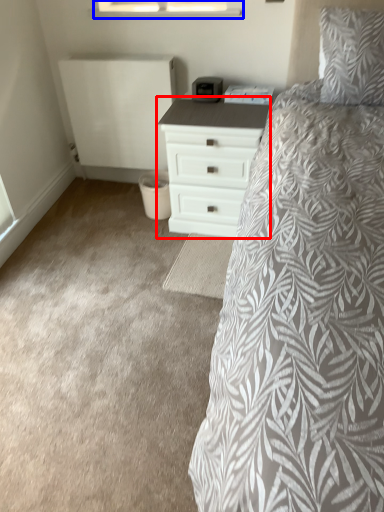
Question: Which object is closer to the camera taking this photo, chest of drawers (highlighted by a red box) or window (highlighted by a blue box)?

Choices:
 (A) chest of drawers
 (B) window

Answer: (A)